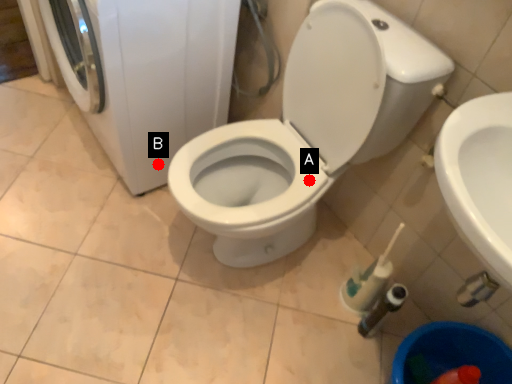
Question: Two points are circled on the image, labeled by A and B beside each circle. Which point appears closest to the camera in this image?

Choices:
 (A) A is closer
 (B) B is closer

Answer: (A)